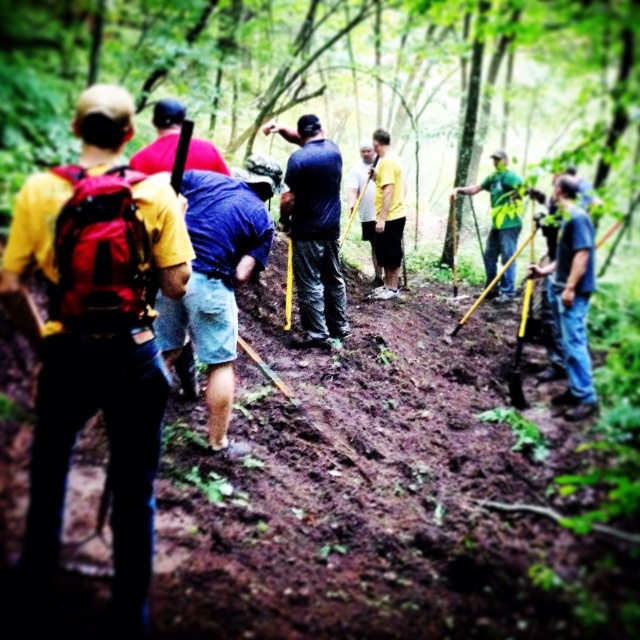
Question: Where is dark blue shirt at center located in relation to yellow matte shirt at center in the image?

Choices:
 (A) below
 (B) above

Answer: (A)

Question: Among these points, which one is farthest from the camera?

Choices:
 (A) (204, 154)
 (B) (262, 132)

Answer: (B)

Question: Is blue jeans at center wider than white matte shirt at center?

Choices:
 (A) yes
 (B) no

Answer: (A)

Question: Which object is positioned closest to the yellow t-shirt at center?

Choices:
 (A) green matte shirt at center
 (B) dark blue shirt at center
 (C) blue denim shorts at center
 (D) white matte shirt at center

Answer: (D)

Question: Which object is positioned closest to the yellow t-shirt at center?

Choices:
 (A) yellow matte backpack at left
 (B) yellow matte shirt at center
 (C) green matte shirt at center
 (D) blue denim shorts at center

Answer: (C)

Question: Can you confirm if blue denim shorts at center is positioned to the left of yellow matte shirt at center?

Choices:
 (A) no
 (B) yes

Answer: (A)